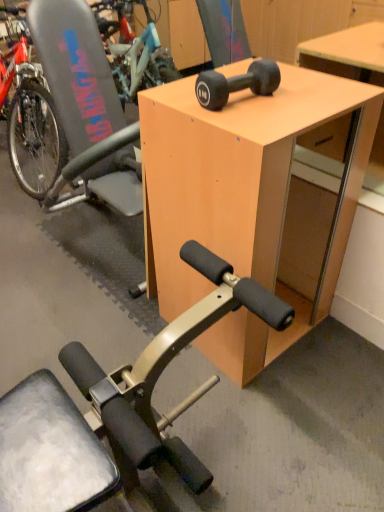
Find the location of a particular element. This screenshot has height=512, width=384. free space on the front side of black rubber dumbbell at upper center is located at coordinates (253, 120).